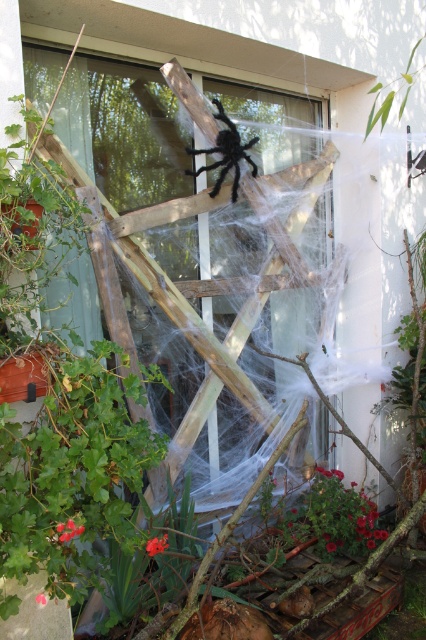
Does green matte plant at lower right have a smaller size compared to black fuzzy spider at upper center?

No, green matte plant at lower right is not smaller than black fuzzy spider at upper center.

Does point (344, 536) come behind point (227, 164)?

Yes.

Find the location of `green matte plant at lower right`. green matte plant at lower right is located at coordinates (339, 515).